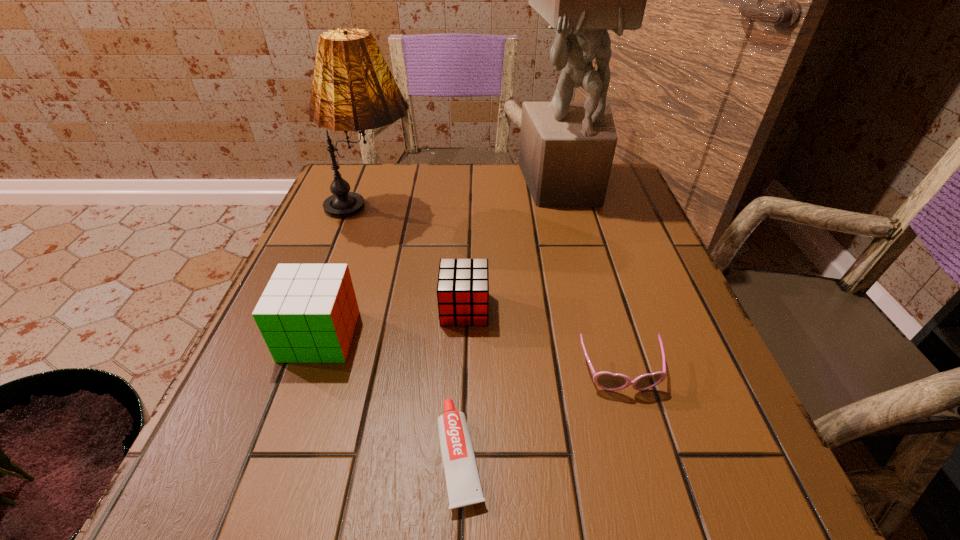
At what (x,y) coordinates should I click in order to perform the action: click on empty space that is in between the left cube and the toothpaste. Please return your answer as a coordinate pair (x, y). The width and height of the screenshot is (960, 540). Looking at the image, I should click on pos(390,396).

Where is `vacant space in between the nearest object and the sculpture`? Image resolution: width=960 pixels, height=540 pixels. vacant space in between the nearest object and the sculpture is located at coordinates (513, 320).

The height and width of the screenshot is (540, 960). Identify the location of free point between the second shortest object and the fifth shortest object. (495, 293).

Find the location of `vacant point located between the nearest object and the shorter cube`. vacant point located between the nearest object and the shorter cube is located at coordinates (463, 382).

Identify the location of empty space between the left cube and the shortest object. This screenshot has height=540, width=960. (390, 396).

This screenshot has height=540, width=960. What are the coordinates of `empty space between the lampshade and the shortest object` in the screenshot? It's located at (416, 334).

Locate an element on the screen. This screenshot has width=960, height=540. free space between the taller cube and the right cube is located at coordinates (392, 322).

The image size is (960, 540). What are the coordinates of `free spot between the nearest object and the second shortest object` in the screenshot? It's located at (540, 414).

Find the location of a particular element. The image size is (960, 540). empty location between the sunglasses and the lampshade is located at coordinates (495, 293).

At what (x,y) coordinates should I click in order to perform the action: click on vacant space in between the shortest object and the right cube. Please return your answer as a coordinate pair (x, y). This screenshot has height=540, width=960. Looking at the image, I should click on (463, 382).